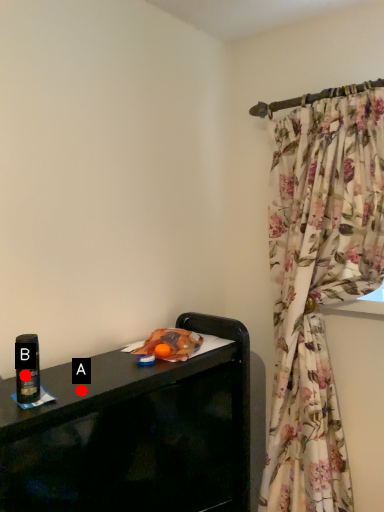
Question: Two points are circled on the image, labeled by A and B beside each circle. Which of the following is the farthest from the observer?

Choices:
 (A) A is further
 (B) B is further

Answer: (A)